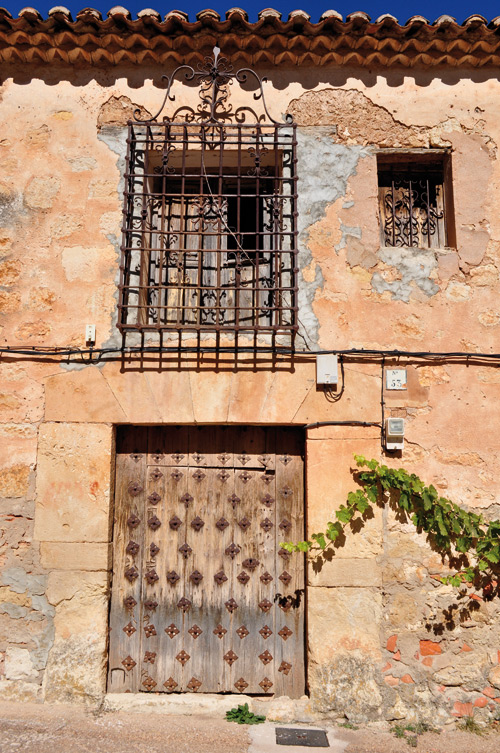
Locate an element on the screen. empty space left side of door is located at coordinates (99, 467), (28, 462), (30, 665), (81, 654).